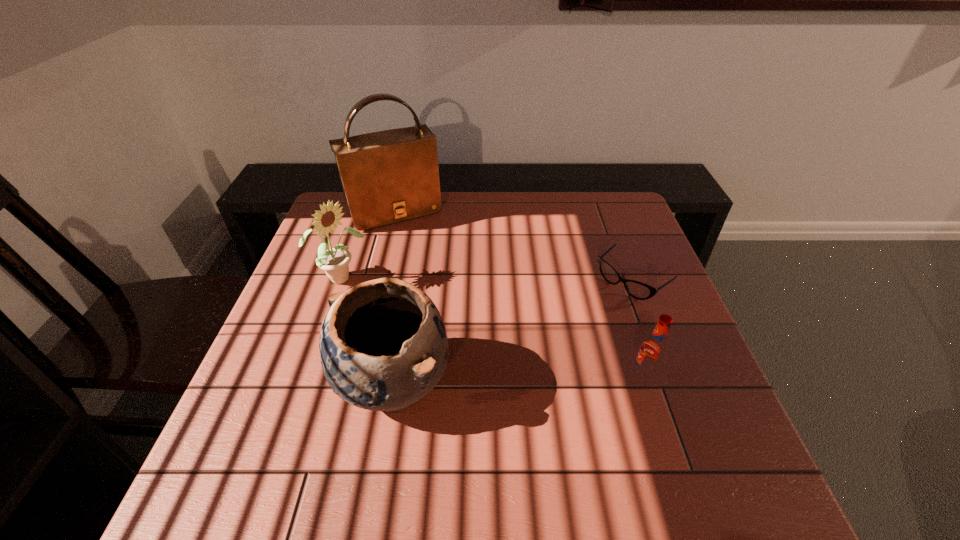
In order to click on free spot located 0.300m on the front flap of the shoulder bag in this screenshot , I will do `click(444, 294)`.

Where is `free spot located on the front-facing side of the sunflower`? free spot located on the front-facing side of the sunflower is located at coordinates (418, 321).

Identify the location of vacant position located 0.120m on the front-facing side of the sunflower. point(395,307).

The width and height of the screenshot is (960, 540). Identify the location of free space located 0.060m on the front-facing side of the sunflower. (x=377, y=296).

Find the location of a particular element. free space located 0.260m on the front-facing side of the shortest object is located at coordinates (541, 354).

Where is `free location located 0.290m on the front-facing side of the shortest object`? Image resolution: width=960 pixels, height=540 pixels. free location located 0.290m on the front-facing side of the shortest object is located at coordinates (533, 362).

Where is `free space located on the front-facing side of the shortest object`? The height and width of the screenshot is (540, 960). free space located on the front-facing side of the shortest object is located at coordinates (550, 347).

Where is `object that is at the far edge`? object that is at the far edge is located at coordinates (390, 176).

Where is `object situated at the near edge`? Image resolution: width=960 pixels, height=540 pixels. object situated at the near edge is located at coordinates (383, 346).

Where is `shoulder bag that is at the left edge`? The height and width of the screenshot is (540, 960). shoulder bag that is at the left edge is located at coordinates (390, 176).